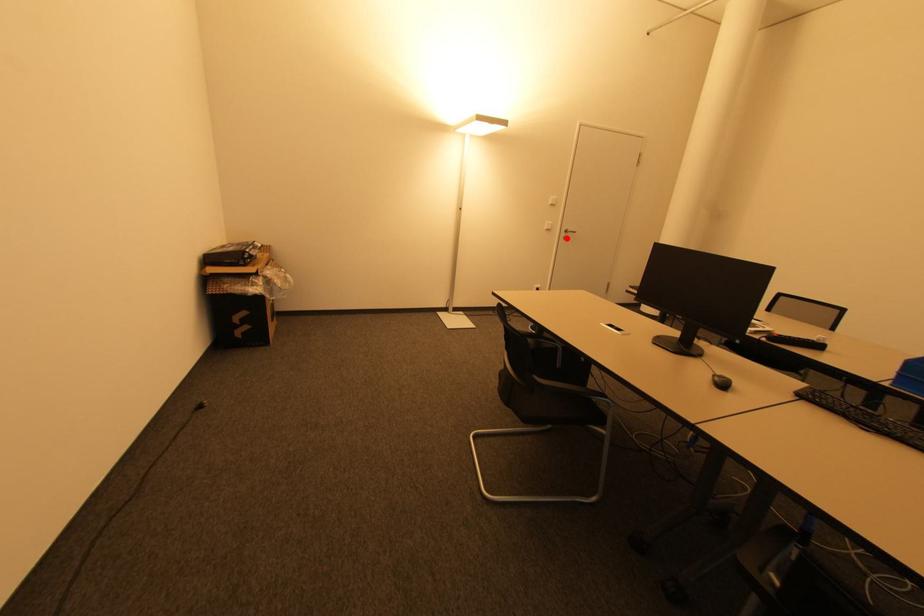
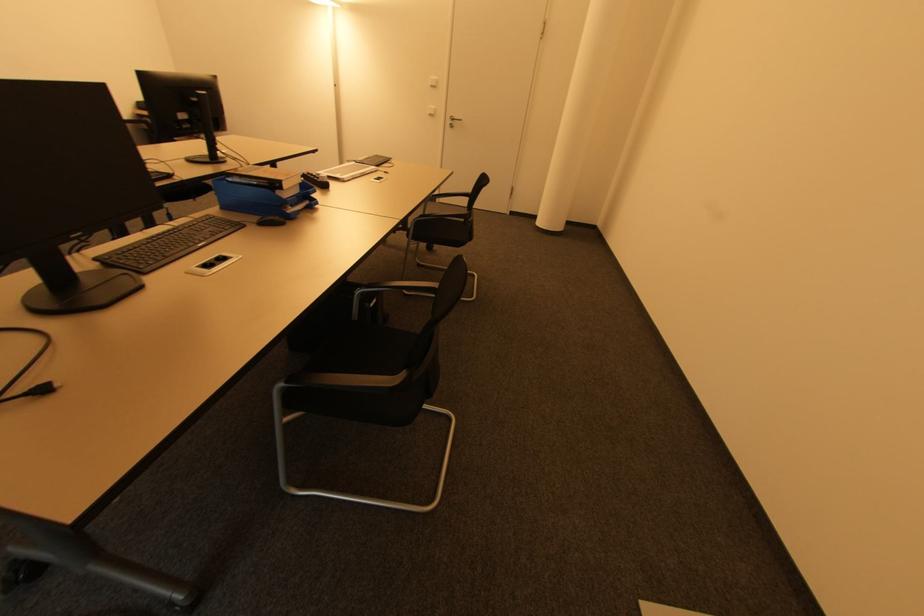
Find the pixel in the second image that matches the highlighted location in the first image.

(454, 127)